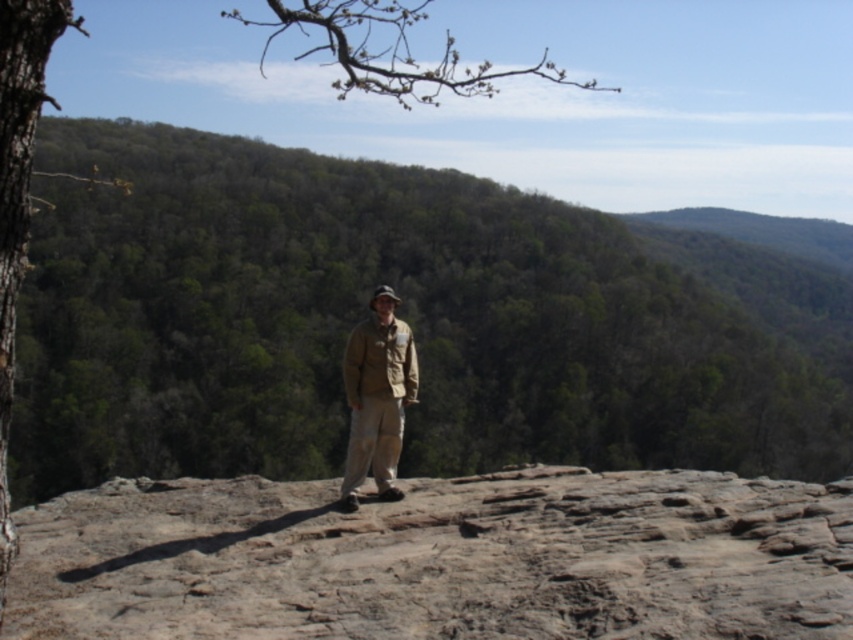
Question: Which is nearer to the khaki fabric jacket at center?

Choices:
 (A) smooth bark tree at upper left
 (B) green leafy mountain at center
 (C) brown rocky hillside at center

Answer: (C)

Question: Which is farther from the smooth bark tree at upper left?

Choices:
 (A) brown rocky hillside at center
 (B) khaki fabric jacket at center

Answer: (A)

Question: Which point is closer to the camera taking this photo?

Choices:
 (A) (393, 320)
 (B) (73, 506)
 (C) (705, 323)
 (D) (323, 48)

Answer: (A)

Question: Can you confirm if brown rocky hillside at center is bigger than khaki fabric jacket at center?

Choices:
 (A) no
 (B) yes

Answer: (A)

Question: Is green leafy mountain at center above brown rocky hillside at center?

Choices:
 (A) yes
 (B) no

Answer: (A)

Question: Does green leafy mountain at center have a lesser width compared to smooth bark tree at upper left?

Choices:
 (A) no
 (B) yes

Answer: (A)